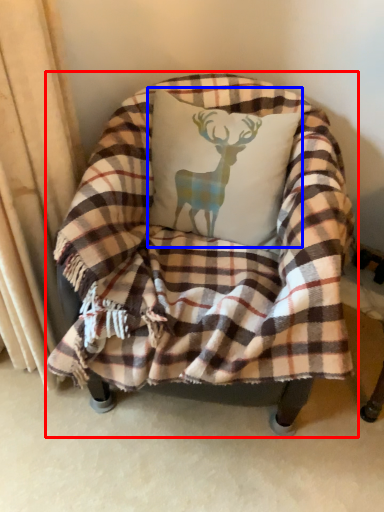
Question: Which object appears closest to the camera in this image, chair (highlighted by a red box) or throw pillow (highlighted by a blue box)?

Choices:
 (A) chair
 (B) throw pillow

Answer: (A)